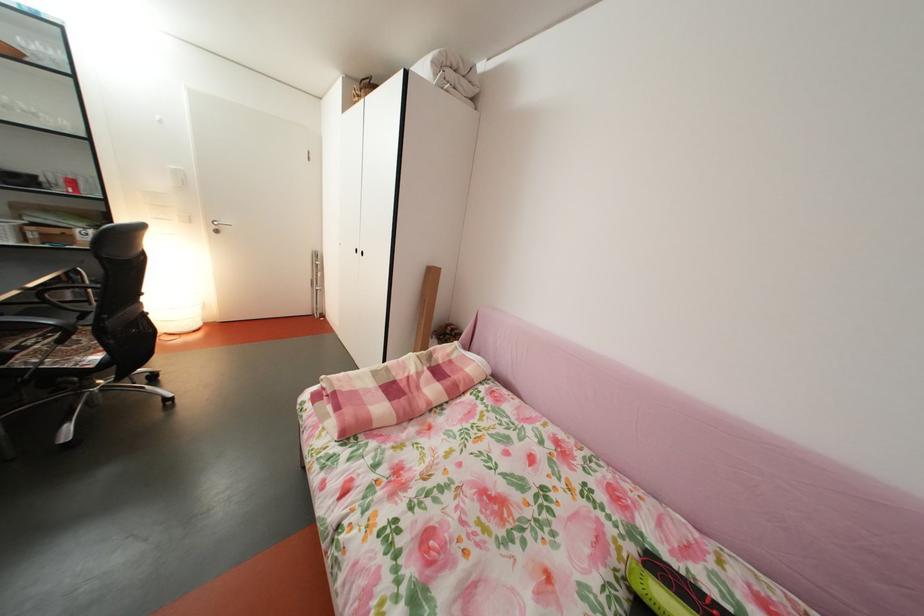
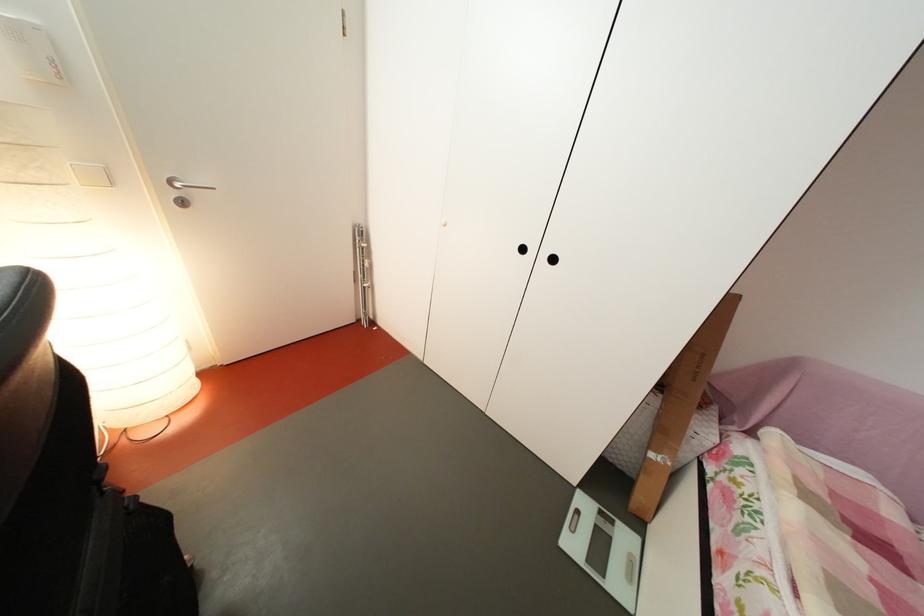
The images are taken continuously from a first-person perspective. In which direction are you moving?

The cameraman walked toward left, forward.